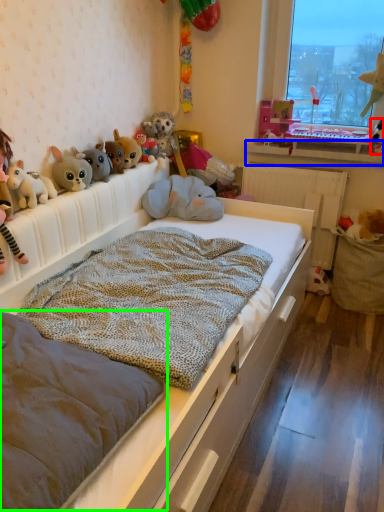
Question: Which object is positioned farthest from toy (highlighted by a red box)? Select from window sill (highlighted by a blue box) and mattress (highlighted by a green box).

Choices:
 (A) window sill
 (B) mattress

Answer: (B)